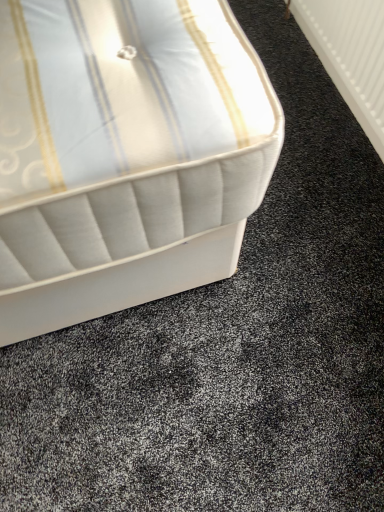
Identify the location of vacant area on top of white fabric bed at upper left (from a real-world perspective). The height and width of the screenshot is (512, 384). point(254,284).